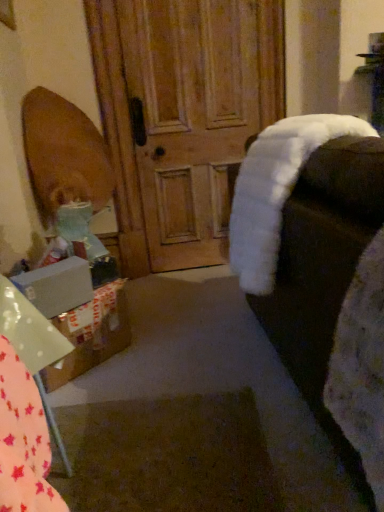
You are a GUI agent. You are given a task and a screenshot of the screen. Output one action in this format:
    pyautogui.click(x=<x>, y=<y>)
    Task: Click on the vacant area that is situated to the right of white cardboard box at lower left
    
    Given the screenshot: What is the action you would take?
    pyautogui.click(x=149, y=353)